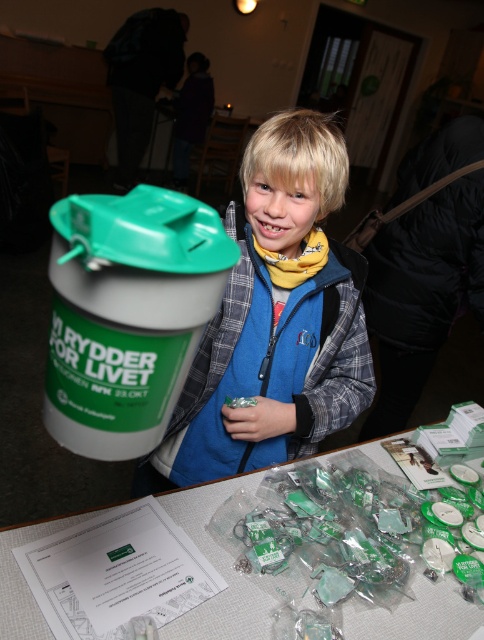
Does blue fleece jacket at center appear on the left side of translucent plastic table at center?

Indeed, blue fleece jacket at center is positioned on the left side of translucent plastic table at center.

Describe the element at coordinates (274, 320) in the screenshot. This screenshot has width=484, height=640. I see `blue fleece jacket at center` at that location.

Where is `blue fleece jacket at center`? This screenshot has height=640, width=484. blue fleece jacket at center is located at coordinates (274, 320).